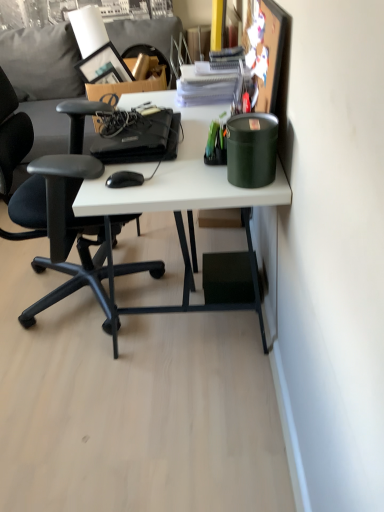
Image resolution: width=384 pixels, height=512 pixels. I want to click on unoccupied area behind black plastic mouse at center, so click(x=135, y=165).